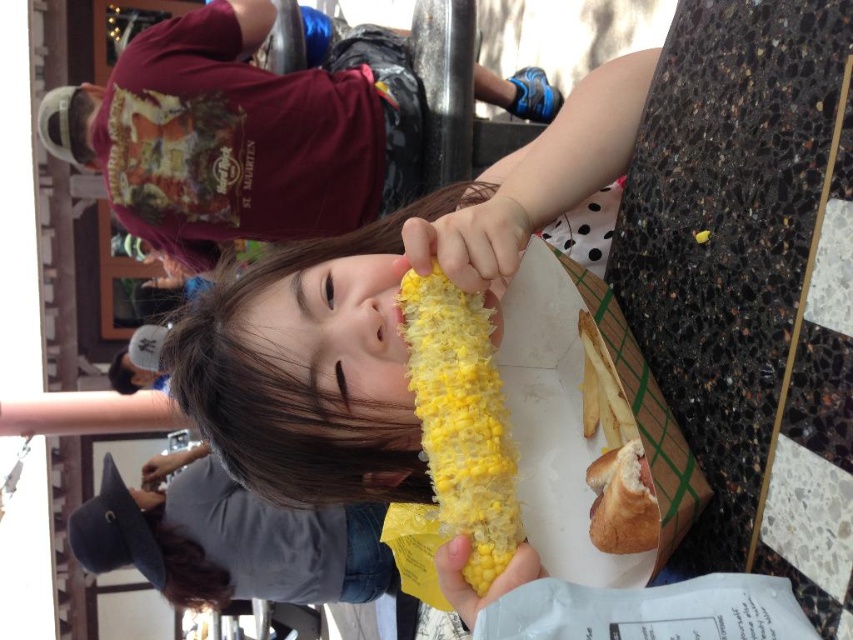
You are standing in front of the table where the girl is eating. There are two points marked on the table. One is at coordinate point (515,472) and the other at point (605,474). Which point is closer to you?

Point (515,472) is closer to you since it is further to the camera than point (605,474).

You are a food delivery robot that needs to pick up the yellow matte corn at center and the hot dog in a bun on the left. The robot has a maximum reach of 60 centimeters. Can you reach both items without moving?

The yellow matte corn at center and the hot dog in a bun on the left are 68.18 centimeters apart, which exceeds the robot maximum reach of 60 centimeters. The robot cannot reach both items without moving.

You are a food delivery robot that needs to pick up the yellow matte corn at center and the golden bread hot dog at lower right. However, you can only pick up items that are not covered by other objects. Can you pick up both items?

The yellow matte corn at center is positioned over golden bread hot dog at lower right, so the corn is covering the hot dog. Therefore, you cannot pick up the golden bread hot dog at lower right until you move the corn first.